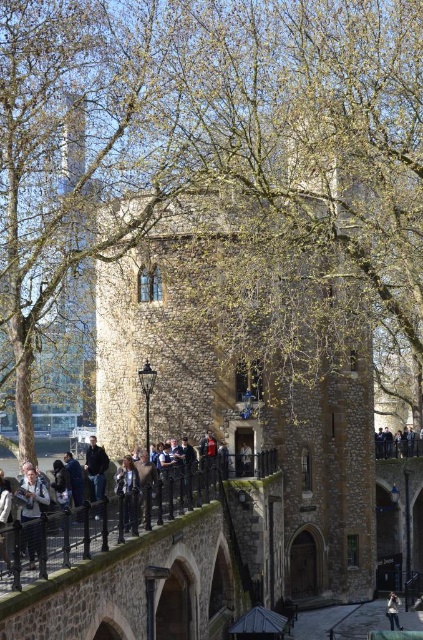
You are standing at the center of the image. There is a point marked at coordinates (398,444). What object is located at this point?

dark blue jeans at lower right is located at point (398,444).

You are standing at the center of the paved area in front of the historic stone building. You notice a denim jacket at lower left. If you want to pick up the jacket, which direction should you move relative to your current position?

The denim jacket at lower left is located at point (32,493), which is to the lower left direction from your current position at the center. Move towards the lower left to reach it.

You are standing in front of the Tower of London building and notice two visitors. One is wearing dark blue jeans at lower right and the other has a light brown leather jacket at center. Which visitor is positioned higher from the ground?

The dark blue jeans at lower right is above the light brown leather jacket at center, so the visitor wearing dark blue jeans at lower right is positioned higher from the ground.